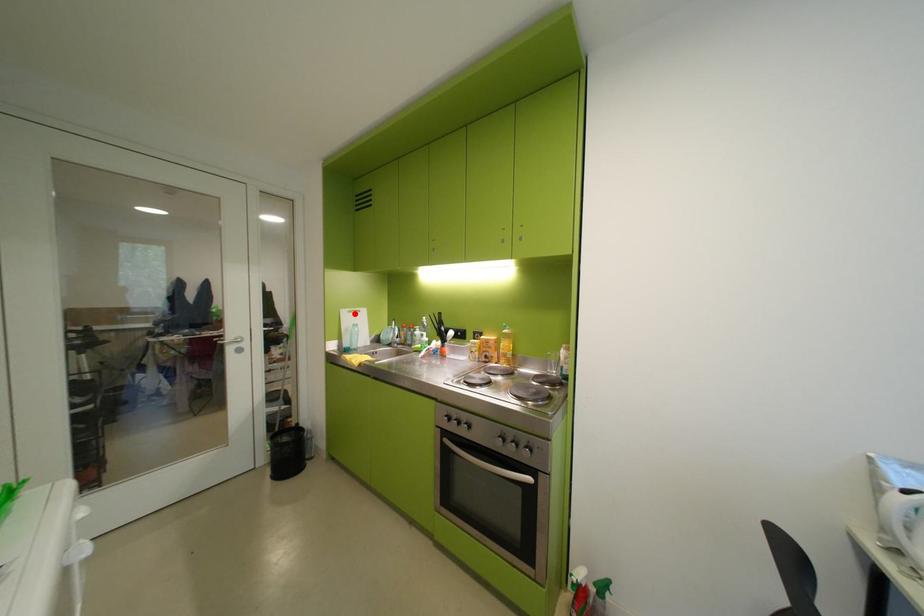
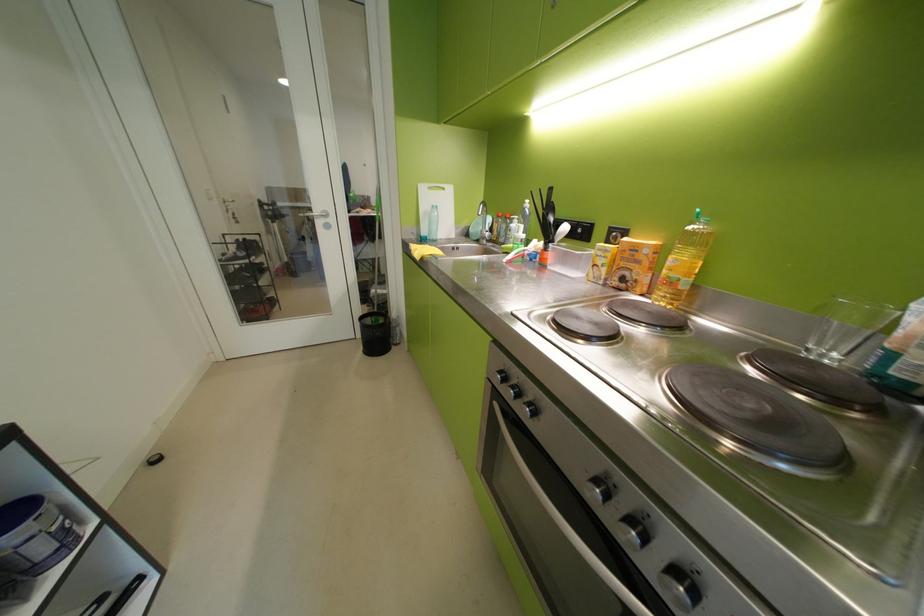
Question: I am providing you with two images of the same scene from different viewpoints. A red point is shown in image1. For the corresponding object point in image2, is it positioned nearer or farther from the camera?

Choices:
 (A) Nearer
 (B) Farther

Answer: (A)